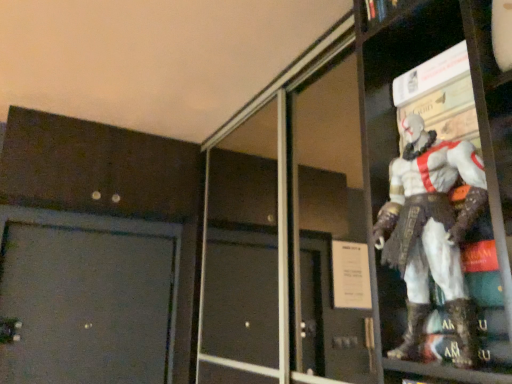
Question: From a real-world perspective, is white matte figure at upper right positioned above or below transparent glass screen door at upper right?

Choices:
 (A) above
 (B) below

Answer: (B)

Question: Considering the positions of white matte figure at upper right and transparent glass screen door at upper right in the image, is white matte figure at upper right taller or shorter than transparent glass screen door at upper right?

Choices:
 (A) tall
 (B) short

Answer: (B)

Question: In the image, is white matte figure at upper right on the left side or the right side of transparent glass screen door at upper right?

Choices:
 (A) right
 (B) left

Answer: (A)

Question: From their relative heights in the image, would you say transparent glass screen door at upper right is taller or shorter than white matte figure at upper right?

Choices:
 (A) short
 (B) tall

Answer: (B)

Question: Is transparent glass screen door at upper right spatially inside white matte figure at upper right, or outside of it?

Choices:
 (A) inside
 (B) outside

Answer: (B)

Question: From a real-world perspective, is transparent glass screen door at upper right physically located above or below white matte figure at upper right?

Choices:
 (A) above
 (B) below

Answer: (A)

Question: Considering the positions of transparent glass screen door at upper right and white matte figure at upper right in the image, is transparent glass screen door at upper right bigger or smaller than white matte figure at upper right?

Choices:
 (A) small
 (B) big

Answer: (B)